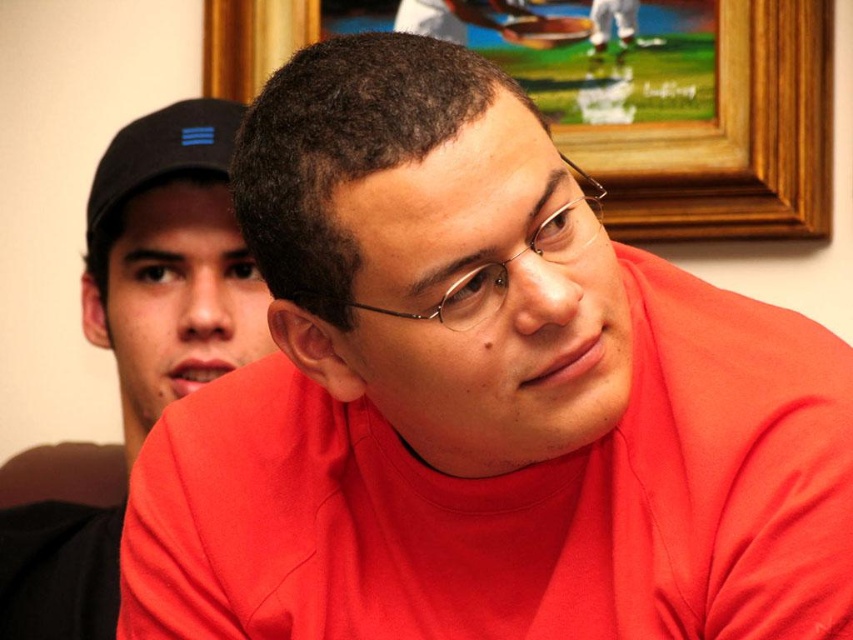
Question: Is black matte baseball cap at upper left below metallic wireframe glasses at center?

Choices:
 (A) no
 (B) yes

Answer: (A)

Question: Does black matte baseball cap at upper left appear on the left side of metallic wireframe glasses at center?

Choices:
 (A) no
 (B) yes

Answer: (B)

Question: Which object is the closest to the matte black cap at upper left?

Choices:
 (A) wooden picture frame at upper center
 (B) metallic wireframe glasses at center
 (C) black matte baseball cap at upper left

Answer: (C)

Question: Which point is farther to the camera?

Choices:
 (A) 163,116
 (B) 553,232

Answer: (A)

Question: Does matte black cap at upper left appear on the left side of black matte baseball cap at upper left?

Choices:
 (A) no
 (B) yes

Answer: (B)

Question: Which object is farther from the camera taking this photo?

Choices:
 (A) black matte baseball cap at upper left
 (B) metallic wireframe glasses at center
 (C) wooden picture frame at upper center
 (D) matte black cap at upper left

Answer: (C)